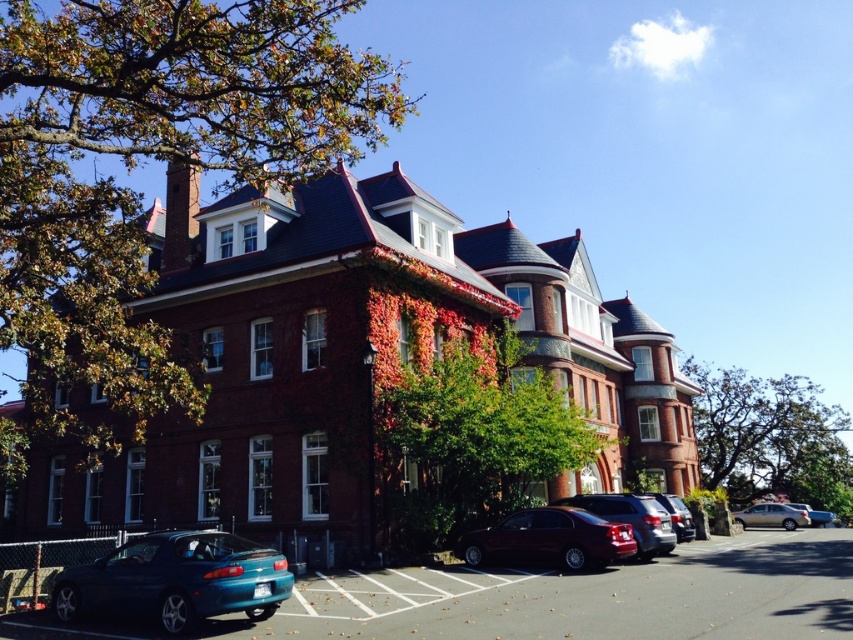
Question: Which point is farther to the camera?

Choices:
 (A) green leafy tree at center
 (B) metallic silver sedan at lower right

Answer: (B)

Question: Which point is closer to the camera taking this photo?

Choices:
 (A) (796, 483)
 (B) (752, 584)
 (C) (791, 502)

Answer: (B)

Question: Which object is the closest to the satin silver sedan at center?

Choices:
 (A) green leafy tree at upper left
 (B) green leafy tree at center
 (C) shiny silver sedan at center
 (D) green leafy tree at right

Answer: (C)

Question: Can you confirm if teal plastic car at lower left is smaller than silver metallic sedan at lower right?

Choices:
 (A) no
 (B) yes

Answer: (A)

Question: In this image, where is teal plastic car at lower left located relative to green leafy tree at right?

Choices:
 (A) below
 (B) above

Answer: (B)

Question: Does satin silver sedan at center come behind metallic silver sedan at lower right?

Choices:
 (A) no
 (B) yes

Answer: (A)